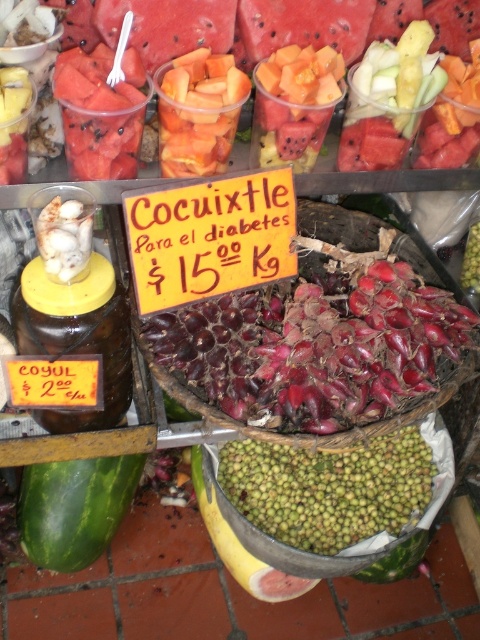
Question: Does shiny red onion at center appear on the right side of orange fleshed at center?

Choices:
 (A) yes
 (B) no

Answer: (A)

Question: Which object is the closest to the orange fleshed at center?

Choices:
 (A) green matte seeds at center
 (B) shiny red onion at center

Answer: (B)

Question: Which point is closer to the camera?

Choices:
 (A) (220, 58)
 (B) (314, 413)
 (C) (339, 461)

Answer: (B)

Question: Does green matte seeds at center appear under orange fleshed at center?

Choices:
 (A) no
 (B) yes

Answer: (B)

Question: Does shiny red onion at center appear under green matte seeds at center?

Choices:
 (A) yes
 (B) no

Answer: (B)

Question: Which point appears closest to the camera in this image?

Choices:
 (A) (324, 458)
 (B) (226, 296)

Answer: (B)